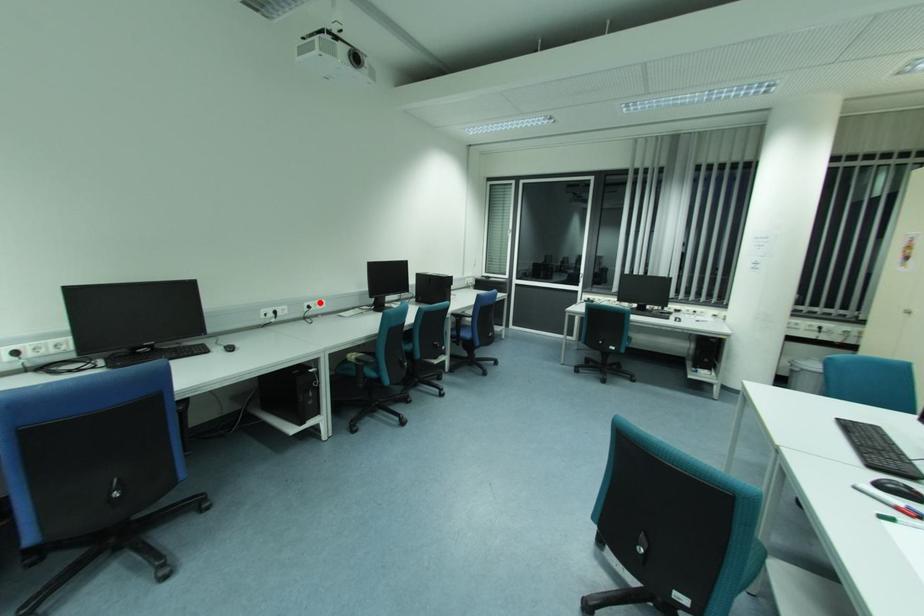
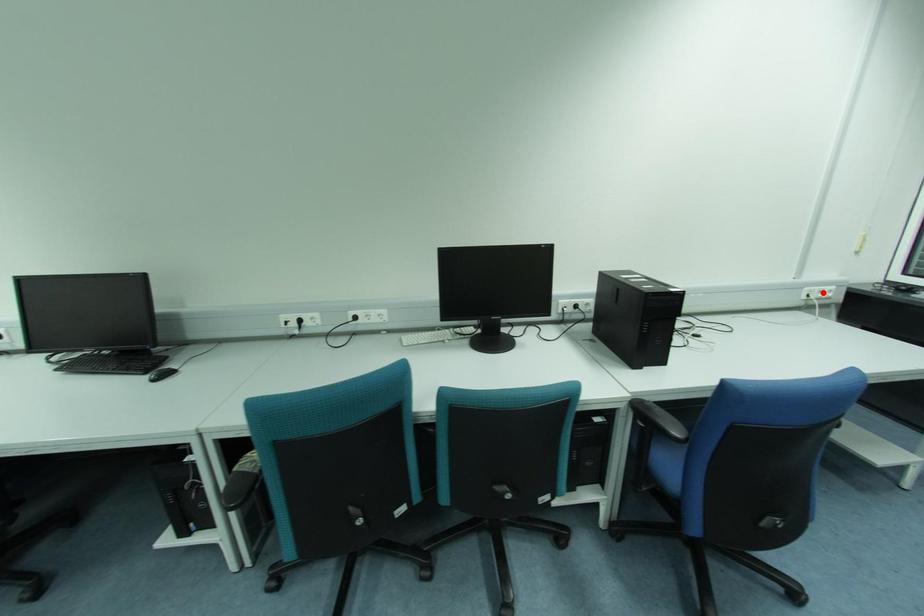
I am providing you with two images of the same scene from different viewpoints. A red point is marked on the first image and another point is marked on the second image. Is the red point in image1 aligned with the point shown in image2?

No